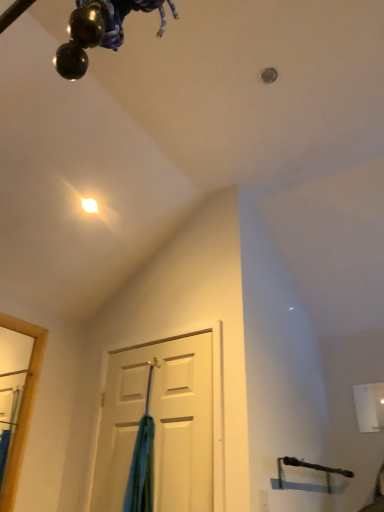
Question: In the image, is white matte door at center positioned in front of or behind blue fabric at center?

Choices:
 (A) front
 (B) behind

Answer: (A)

Question: From the image's perspective, relative to blue fabric at center, is white matte door at center above or below?

Choices:
 (A) above
 (B) below

Answer: (A)

Question: Considering the positions of point [x=173, y=342] and point [x=142, y=476], is point [x=173, y=342] closer or farther from the camera than point [x=142, y=476]?

Choices:
 (A) farther
 (B) closer

Answer: (A)

Question: Is blue fabric at center spatially inside white matte door at center, or outside of it?

Choices:
 (A) outside
 (B) inside

Answer: (A)

Question: From the image's perspective, relative to white matte door at center, is blue fabric at center above or below?

Choices:
 (A) below
 (B) above

Answer: (A)

Question: Would you say blue fabric at center is to the left or to the right of white matte door at center in the picture?

Choices:
 (A) right
 (B) left

Answer: (B)

Question: In terms of width, does blue fabric at center look wider or thinner when compared to white matte door at center?

Choices:
 (A) wide
 (B) thin

Answer: (A)